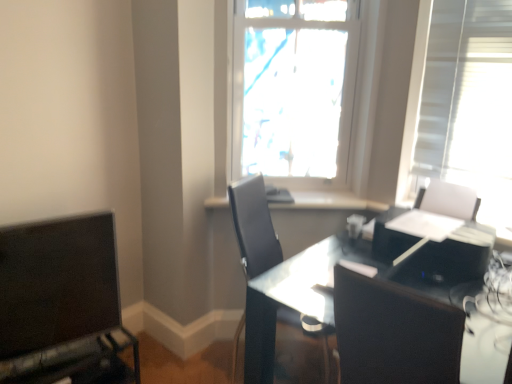
Question: Could you tell me if black leather chair at center is turned towards black glossy printer at right?

Choices:
 (A) yes
 (B) no

Answer: (A)

Question: Is the depth of black leather chair at center greater than that of black glossy printer at right?

Choices:
 (A) no
 (B) yes

Answer: (B)

Question: Considering the relative sizes of black leather chair at center and black glossy printer at right in the image provided, is black leather chair at center bigger than black glossy printer at right?

Choices:
 (A) yes
 (B) no

Answer: (A)

Question: Is black leather chair at center smaller than black glossy printer at right?

Choices:
 (A) no
 (B) yes

Answer: (A)

Question: Is black leather chair at center taller than black glossy printer at right?

Choices:
 (A) yes
 (B) no

Answer: (A)

Question: Can you confirm if black leather chair at center is shorter than black glossy printer at right?

Choices:
 (A) no
 (B) yes

Answer: (A)

Question: From the image's perspective, is transparent glass table at center beneath black leather chair at center?

Choices:
 (A) no
 (B) yes

Answer: (B)

Question: Can you confirm if transparent glass table at center is shorter than black leather chair at center?

Choices:
 (A) no
 (B) yes

Answer: (B)

Question: From a real-world perspective, is transparent glass table at center under black leather chair at center?

Choices:
 (A) yes
 (B) no

Answer: (A)

Question: Can you confirm if transparent glass table at center is positioned to the right of black leather chair at center?

Choices:
 (A) no
 (B) yes

Answer: (B)

Question: Would you consider transparent glass table at center to be distant from black leather chair at center?

Choices:
 (A) no
 (B) yes

Answer: (A)

Question: From a real-world perspective, is transparent glass table at center over black leather chair at center?

Choices:
 (A) yes
 (B) no

Answer: (B)

Question: Would you say matte black monitor at lower left is outside black leather chair at center?

Choices:
 (A) no
 (B) yes

Answer: (B)